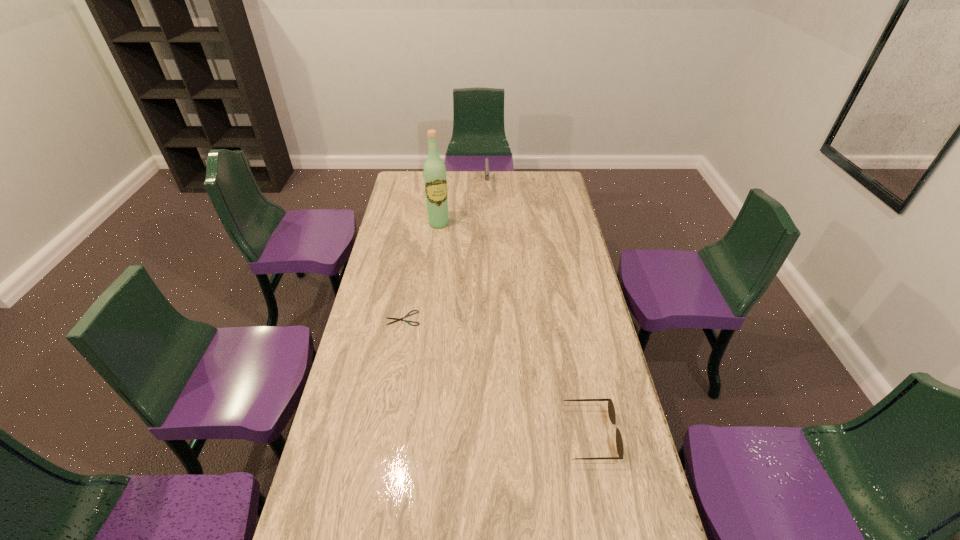
This screenshot has width=960, height=540. Identify the location of shears. (396, 319).

The width and height of the screenshot is (960, 540). Identify the location of the second nearest object. (396, 319).

Image resolution: width=960 pixels, height=540 pixels. What are the coordinates of `the nearest object` in the screenshot? It's located at (611, 410).

Identify the location of the second shortest object. The image size is (960, 540). (611, 410).

Find the location of a particular element. This screenshot has width=960, height=540. the second farthest object is located at coordinates (435, 178).

I want to click on the tallest object, so click(x=435, y=178).

This screenshot has width=960, height=540. Identify the location of the second tallest object. (486, 160).

You are a GUI agent. You are given a task and a screenshot of the screen. Output one action in this format:
    pyautogui.click(x=<x>, y=<y>)
    Task: Click on the pistol
    This screenshot has height=540, width=960.
    Given the screenshot: What is the action you would take?
    pos(486,160)

Find the location of a particular element. vacant area situated on the front of the shortest object is located at coordinates [x=395, y=366].

The width and height of the screenshot is (960, 540). In order to click on free space located 0.070m on the front-facing side of the wine bottle in this screenshot , I will do `click(444, 238)`.